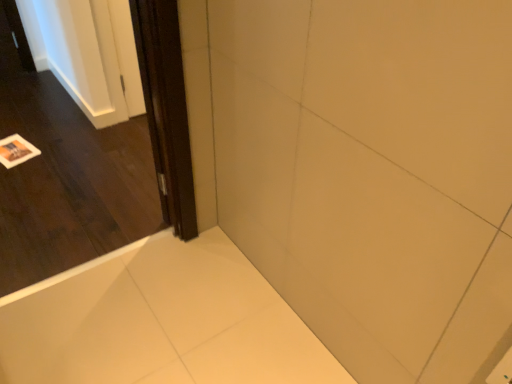
Question: Is dark wood door at left facing towards white glossy bathtub at lower left?

Choices:
 (A) no
 (B) yes

Answer: (B)

Question: Does dark wood door at left lie behind white glossy bathtub at lower left?

Choices:
 (A) yes
 (B) no

Answer: (B)

Question: Considering the relative sizes of dark wood door at left and white glossy bathtub at lower left in the image provided, is dark wood door at left wider than white glossy bathtub at lower left?

Choices:
 (A) yes
 (B) no

Answer: (B)

Question: Is dark wood door at left surrounding white glossy bathtub at lower left?

Choices:
 (A) no
 (B) yes

Answer: (A)

Question: Does dark wood door at left have a larger size compared to white glossy bathtub at lower left?

Choices:
 (A) no
 (B) yes

Answer: (B)

Question: Considering the relative sizes of dark wood door at left and white glossy bathtub at lower left in the image provided, is dark wood door at left taller than white glossy bathtub at lower left?

Choices:
 (A) yes
 (B) no

Answer: (A)

Question: From the image's perspective, is dark wood screen door at left on white glossy bathtub at lower left?

Choices:
 (A) yes
 (B) no

Answer: (A)

Question: Considering the relative positions of dark wood screen door at left and white glossy bathtub at lower left in the image provided, is dark wood screen door at left to the left of white glossy bathtub at lower left from the viewer's perspective?

Choices:
 (A) yes
 (B) no

Answer: (A)

Question: From a real-world perspective, is dark wood screen door at left below white glossy bathtub at lower left?

Choices:
 (A) no
 (B) yes

Answer: (A)

Question: Does dark wood screen door at left turn towards white glossy bathtub at lower left?

Choices:
 (A) no
 (B) yes

Answer: (A)

Question: Does dark wood screen door at left have a lesser width compared to white glossy bathtub at lower left?

Choices:
 (A) no
 (B) yes

Answer: (B)

Question: From the image's perspective, is dark wood screen door at left below white glossy bathtub at lower left?

Choices:
 (A) yes
 (B) no

Answer: (B)

Question: Considering the relative sizes of white glossy bathtub at lower left and dark wood screen door at left in the image provided, is white glossy bathtub at lower left shorter than dark wood screen door at left?

Choices:
 (A) yes
 (B) no

Answer: (A)